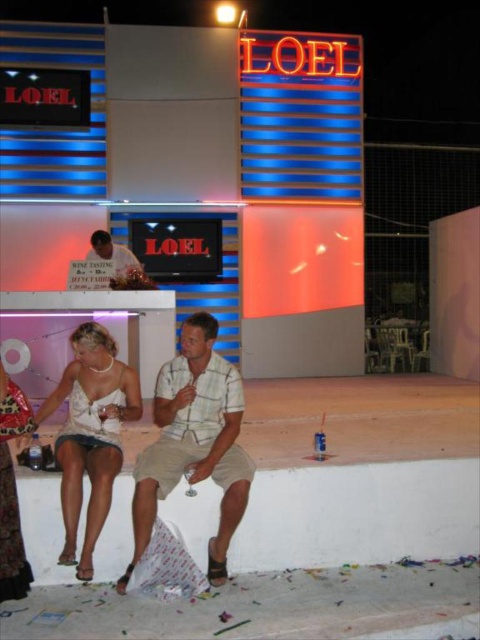
How much distance is there between plaid cotton shirt at center and matte white dress at center?

plaid cotton shirt at center is 12.60 inches away from matte white dress at center.

Which is in front, point (159, 424) or point (92, 428)?

Point (159, 424) is more forward.

You are a GUI agent. You are given a task and a screenshot of the screen. Output one action in this format:
    pyautogui.click(x=<x>, y=<y>)
    Task: Click on the plaid cotton shirt at center
    The height and width of the screenshot is (640, 480).
    Given the screenshot: What is the action you would take?
    tap(193, 442)

Between point (63, 456) and point (131, 253), which one is positioned behind?

Point (131, 253)

Measure the distance between point (129,397) and camera.

The distance of point (129,397) from camera is 3.55 meters.

You are a GUI agent. You are given a task and a screenshot of the screen. Output one action in this format:
    pyautogui.click(x=<x>, y=<y>)
    Task: Click on the matte white dress at center
    
    Given the screenshot: What is the action you would take?
    pyautogui.click(x=91, y=433)

Is plaid cotton shirt at center smaller than plaid shirt at center?

No.

Is plaid cotton shirt at center positioned before plaid shirt at center?

Yes, it is.

Is point (136, 509) in front of point (106, 250)?

Yes, point (136, 509) is closer to viewer.

At what (x,y) coordinates should I click in order to perform the action: click on plaid cotton shirt at center. Please return your answer as a coordinate pair (x, y). Image resolution: width=480 pixels, height=640 pixels. Looking at the image, I should click on (193, 442).